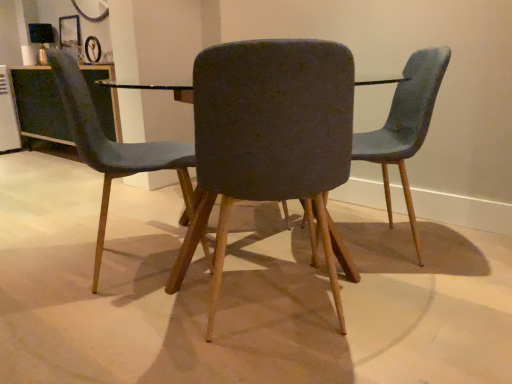
This screenshot has width=512, height=384. Find the location of `vacant area that is in front of velvet blue chair at left, the 1th chair in the left-to-right sequence`. vacant area that is in front of velvet blue chair at left, the 1th chair in the left-to-right sequence is located at coordinates (103, 326).